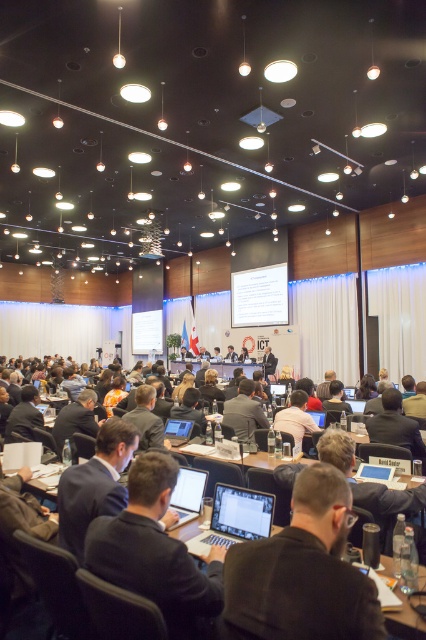
You are a photographer in the conference room and need to position yourself to capture both the dark blue suit at center and the dark brown suit at center in the same frame. Which side should you stand to ensure both are visible without moving the camera?

You should stand to the right of the dark brown suit at center so that both the dark blue suit at center to its left and itself are in the frame.

You are a photographer positioned at the back of the conference room. You need to capture a photo of both the dark blue suit at center and the dark brown leather jacket at center. Since you want to include both in the frame, which object should you adjust your focus to prioritize based on their sizes?

The dark blue suit at center is wider than the dark brown leather jacket at center, so you should prioritize focusing on the dark blue suit at center to ensure it fits properly in the frame.

You are an event organizer who needs to seat VIP guests in the front row. You see the dark blue suit at center and the dark brown leather jacket at center in the conference room. Which one should you approach first to offer a front row seat?

The dark blue suit at center is in front of the dark brown leather jacket at center, so you should approach the dark blue suit at center first since it is closer to the front of the room.